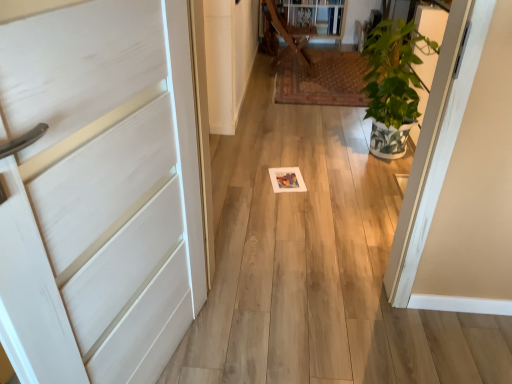
Question: Is wooden at center next to green leafy plant at right and touching it?

Choices:
 (A) yes
 (B) no

Answer: (B)

Question: From a real-world perspective, is wooden at center on top of green leafy plant at right?

Choices:
 (A) yes
 (B) no

Answer: (B)

Question: Is wooden at center at the right side of green leafy plant at right?

Choices:
 (A) no
 (B) yes

Answer: (A)

Question: Would you consider wooden at center to be distant from green leafy plant at right?

Choices:
 (A) no
 (B) yes

Answer: (B)

Question: Is wooden at center aimed at green leafy plant at right?

Choices:
 (A) no
 (B) yes

Answer: (A)

Question: Is green leafy plant at right inside the boundaries of wooden at center, or outside?

Choices:
 (A) outside
 (B) inside

Answer: (A)

Question: Relative to wooden at center, is green leafy plant at right in front or behind?

Choices:
 (A) front
 (B) behind

Answer: (A)

Question: Would you say green leafy plant at right is to the left or to the right of wooden at center in the picture?

Choices:
 (A) left
 (B) right

Answer: (B)

Question: From the image's perspective, is green leafy plant at right positioned above or below wooden at center?

Choices:
 (A) above
 (B) below

Answer: (B)

Question: Is wooden at center to the left or to the right of green leafy plant at right in the image?

Choices:
 (A) left
 (B) right

Answer: (A)

Question: Is wooden at center in front of or behind green leafy plant at right in the image?

Choices:
 (A) front
 (B) behind

Answer: (B)

Question: Is wooden at center inside the boundaries of green leafy plant at right, or outside?

Choices:
 (A) inside
 (B) outside

Answer: (B)

Question: From their relative heights in the image, would you say wooden at center is taller or shorter than green leafy plant at right?

Choices:
 (A) tall
 (B) short

Answer: (B)

Question: From a real-world perspective, relative to white matte door at left, is green leafy plant at right vertically above or below?

Choices:
 (A) below
 (B) above

Answer: (A)

Question: In terms of height, does green leafy plant at right look taller or shorter compared to white matte door at left?

Choices:
 (A) short
 (B) tall

Answer: (A)